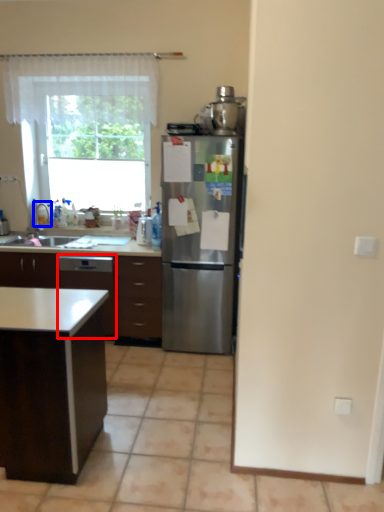
Question: Which point is further to the camera, dish washer (highlighted by a red box) or faucet (highlighted by a blue box)?

Choices:
 (A) dish washer
 (B) faucet

Answer: (B)